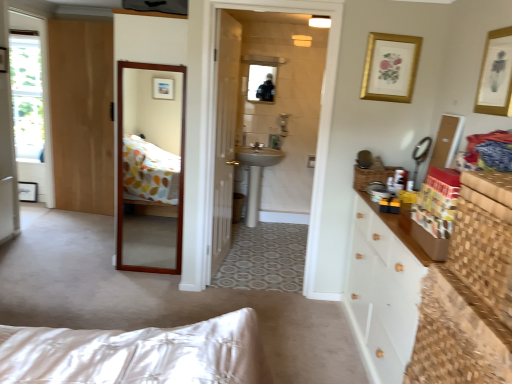
I want to click on free space in front of white ceramic sink at center, so click(x=267, y=244).